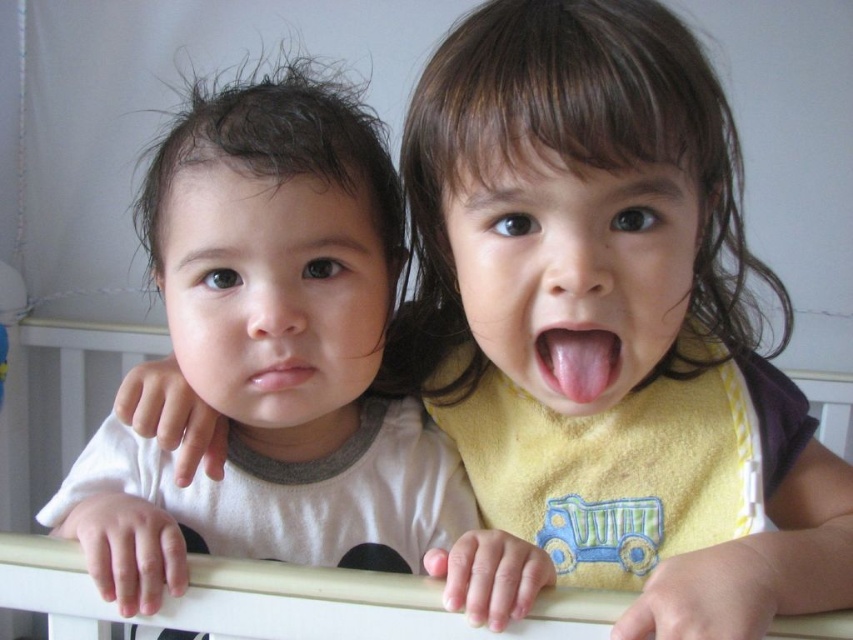
Question: Which of the following is the farthest from the observer?

Choices:
 (A) (326, 628)
 (B) (213, 124)
 (C) (552, 332)
 (D) (503, 504)

Answer: (D)

Question: In this image, where is yellow soft bib at center located relative to pink flesh tongue at center?

Choices:
 (A) above
 (B) below

Answer: (B)

Question: Which of these objects is positioned closest to the white plastic crib at center?

Choices:
 (A) pink flesh tongue at center
 (B) yellow soft bib at center

Answer: (B)

Question: Can you confirm if white matte shirt at left is smaller than white plastic crib at center?

Choices:
 (A) no
 (B) yes

Answer: (A)

Question: Which of the following is the closest to the observer?

Choices:
 (A) (786, 630)
 (B) (616, 360)
 (C) (363, 192)

Answer: (A)

Question: Is white plastic crib at center positioned before pink flesh tongue at center?

Choices:
 (A) yes
 (B) no

Answer: (B)